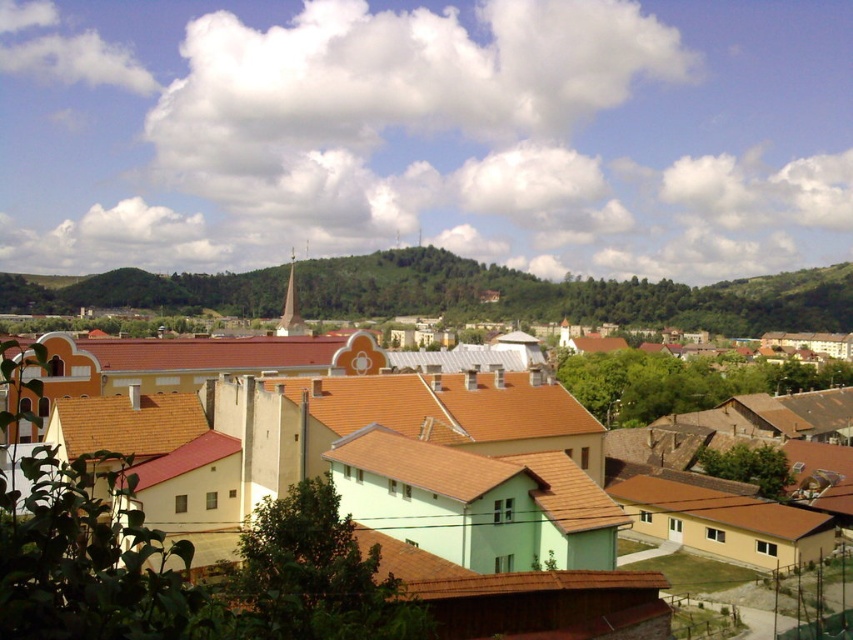
Question: Where is green leafy hillside at center located in relation to brown tile roof at center in the image?

Choices:
 (A) left
 (B) right

Answer: (A)

Question: Which point is closer to the camera?

Choices:
 (A) (340, 445)
 (B) (724, 296)
 (C) (157, 554)

Answer: (C)

Question: Which point appears farthest from the camera in this image?

Choices:
 (A) coord(39,284)
 (B) coord(45,528)

Answer: (A)

Question: Is yellow matte building at center thinner than green leafy hillside at center?

Choices:
 (A) no
 (B) yes

Answer: (B)

Question: From the image, what is the correct spatial relationship of yellow matte building at center in relation to brown tile roof at center?

Choices:
 (A) left
 (B) right

Answer: (A)

Question: Based on their relative distances, which object is nearer to the yellow matte building at center?

Choices:
 (A) green leafy hillside at center
 (B) brown tile roof at center

Answer: (B)